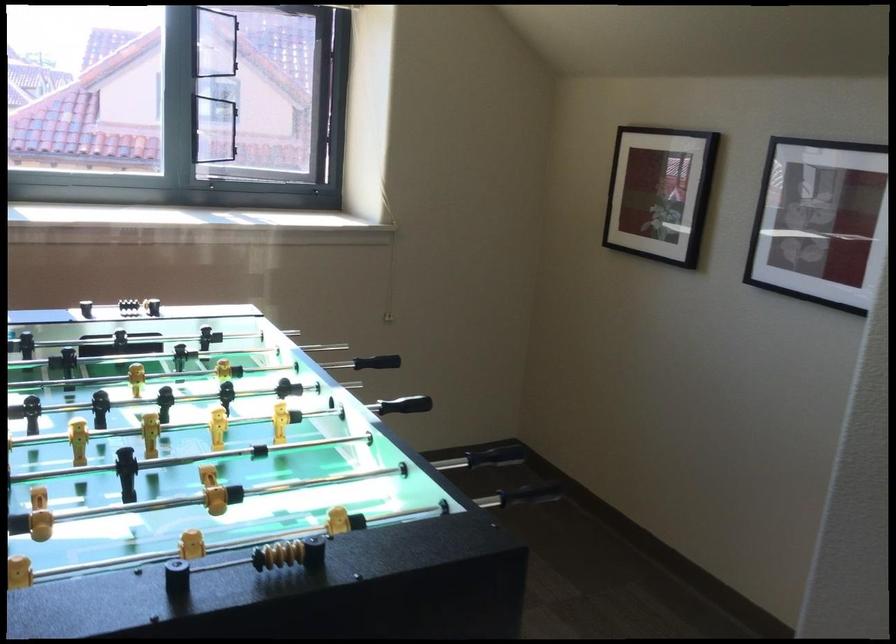
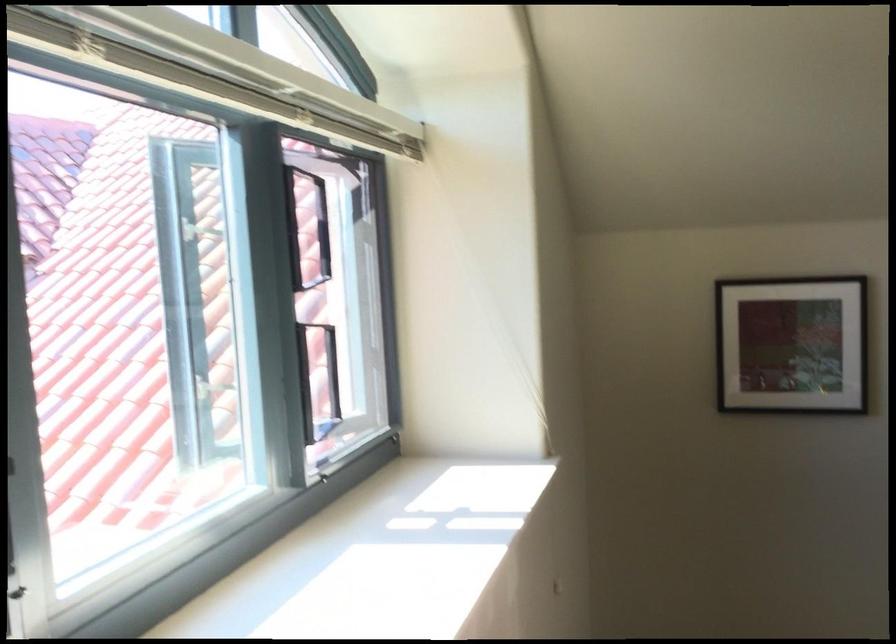
Locate, in the second image, the point that corresponds to (x=357, y=100) in the first image.

(483, 298)